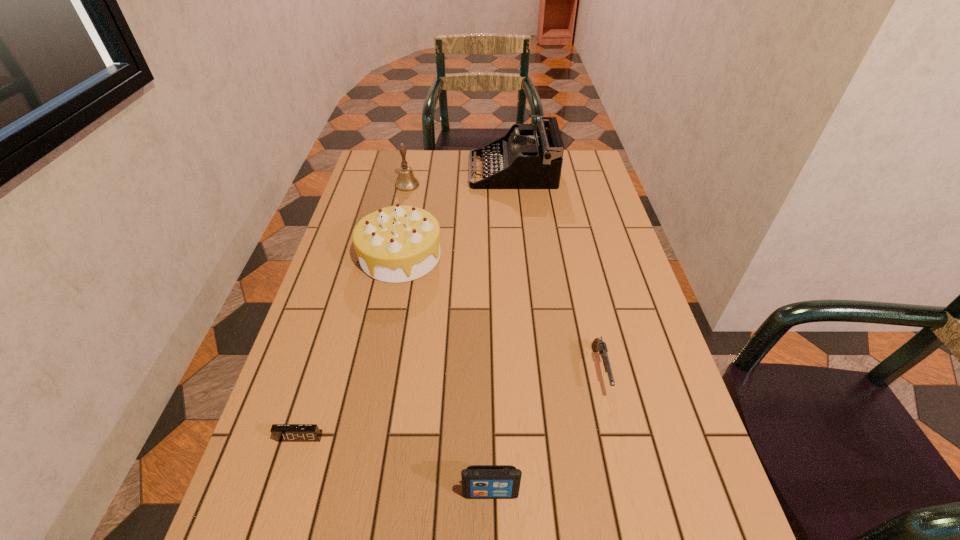
This screenshot has height=540, width=960. I want to click on object that is the second closest to the iPod, so (282, 432).

Find the location of `free spot that satisfies the following two spatial constraints: 1. on the front side of the bell; 2. on the right side of the birthday cake`. free spot that satisfies the following two spatial constraints: 1. on the front side of the bell; 2. on the right side of the birthday cake is located at coordinates (392, 255).